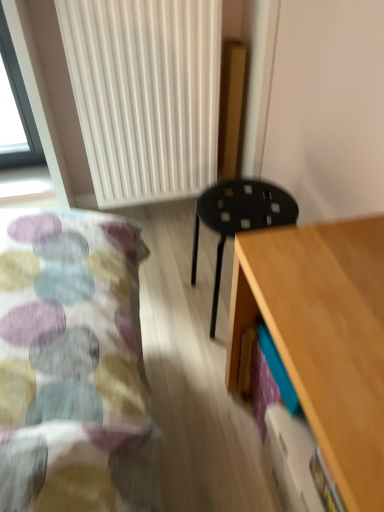
This screenshot has width=384, height=512. I want to click on empty space that is ontop of light wood desk at lower right (from a real-world perspective), so click(x=337, y=305).